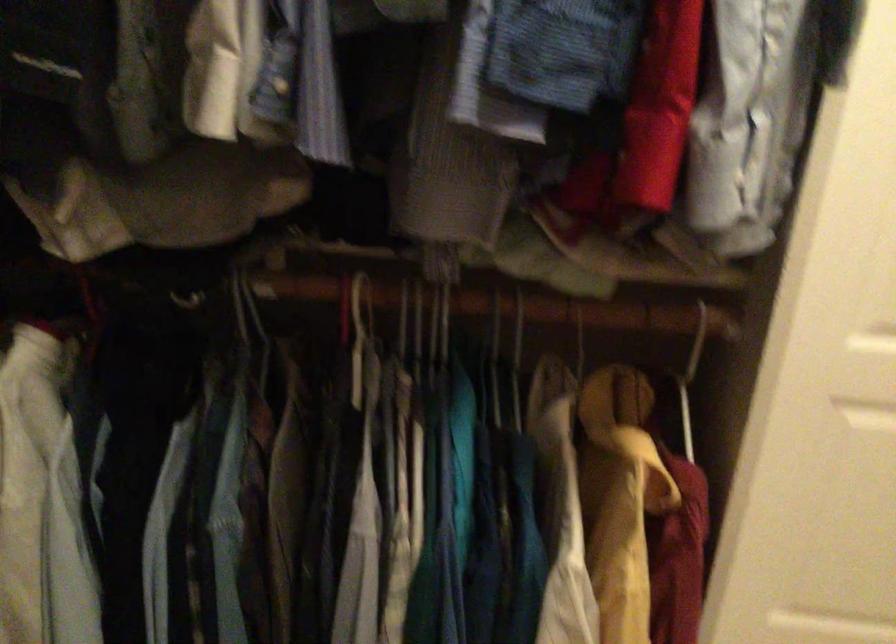
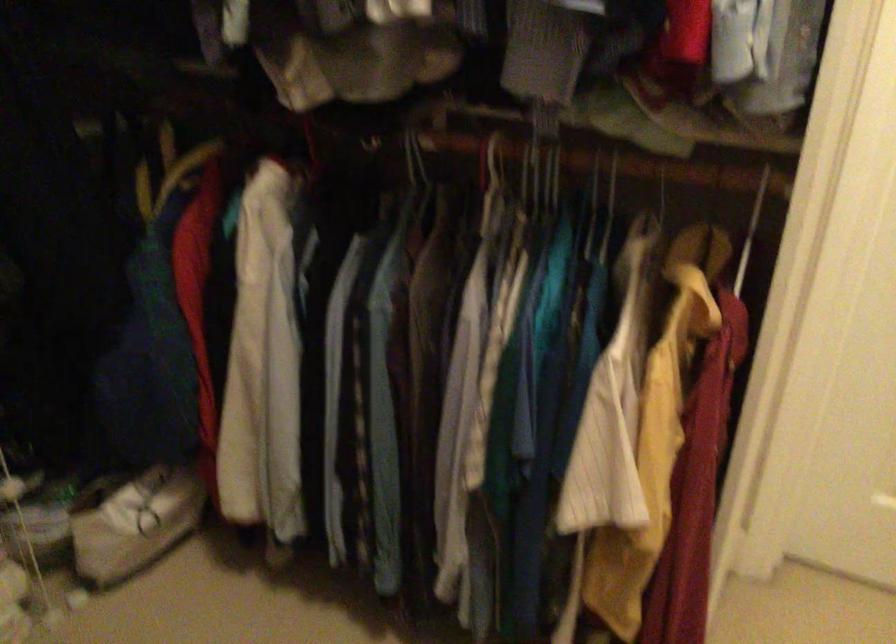
Question: The camera is either moving clockwise (left) or counter-clockwise (right) around the object. The first image is from the beginning of the video and the second image is from the end. Is the camera moving left or right when shooting the video?

Choices:
 (A) Left
 (B) Right

Answer: (B)